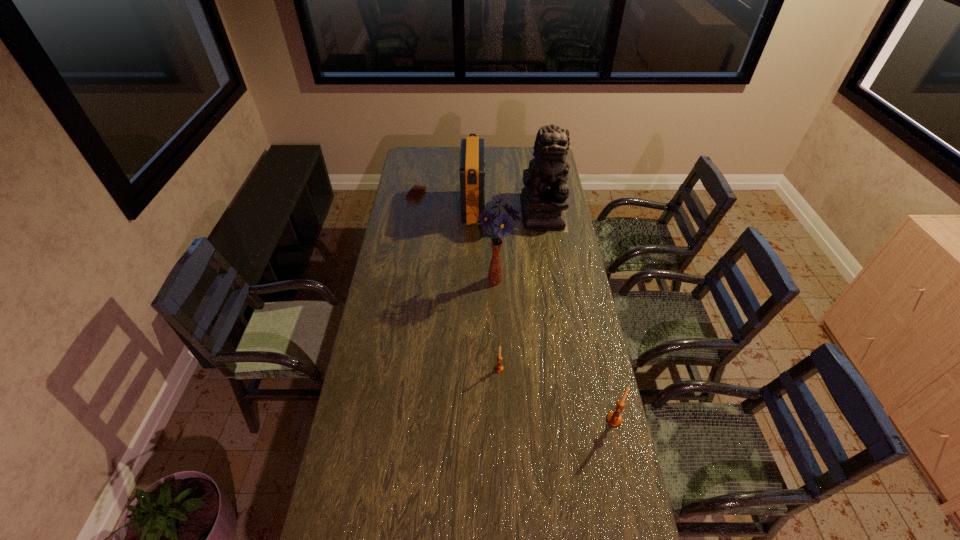
Observe the arrangement of all candle_holders in the image. To keep them evenly spaced, where would you place another candle_holder on the left? Please locate a free space. Please provide its 2D coordinates. Your answer should be formatted as a tuple, i.e. [(x, y)], where the tuple contains the x and y coordinates of a point satisfying the conditions above.

[(401, 326)]